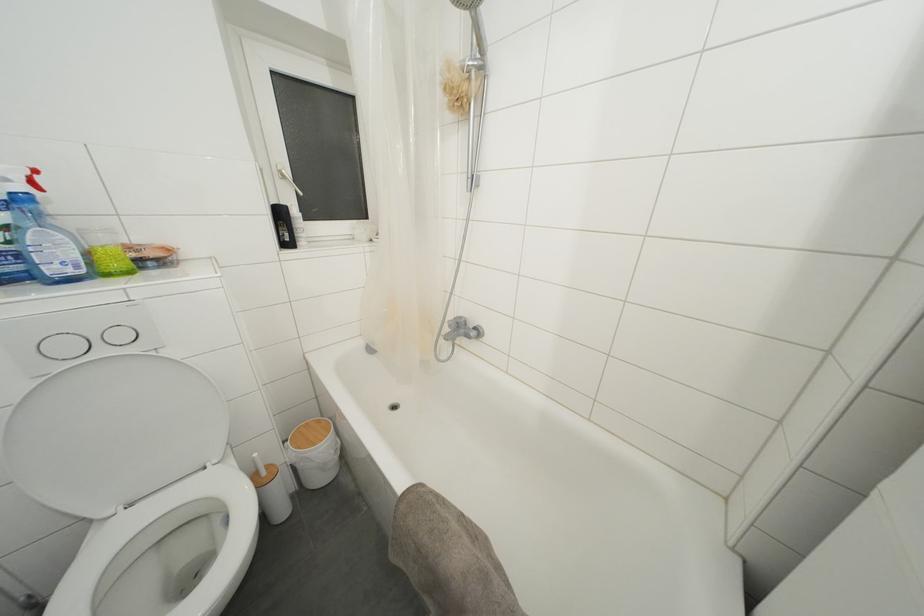
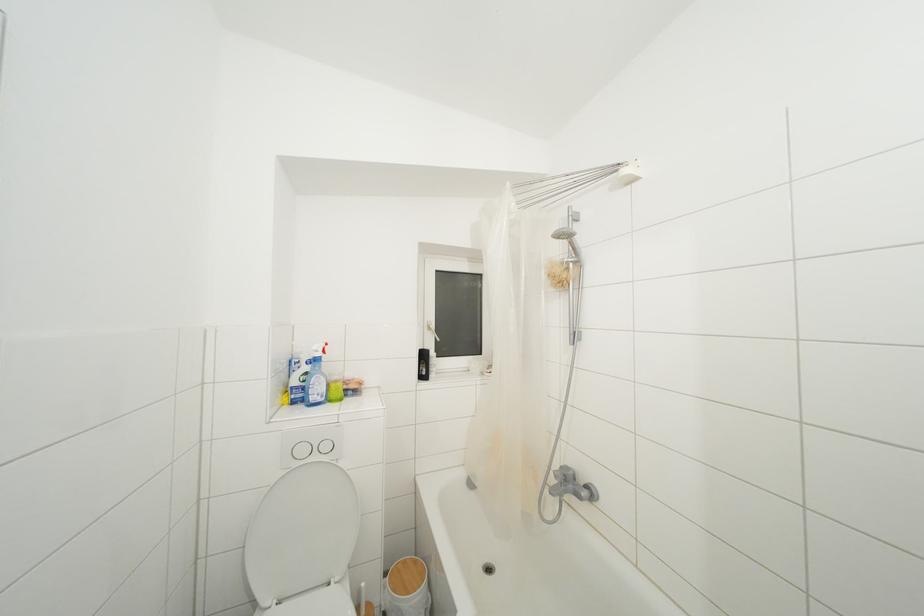
In the second image, find the point that corresponds to point (472, 84) in the first image.

(572, 273)